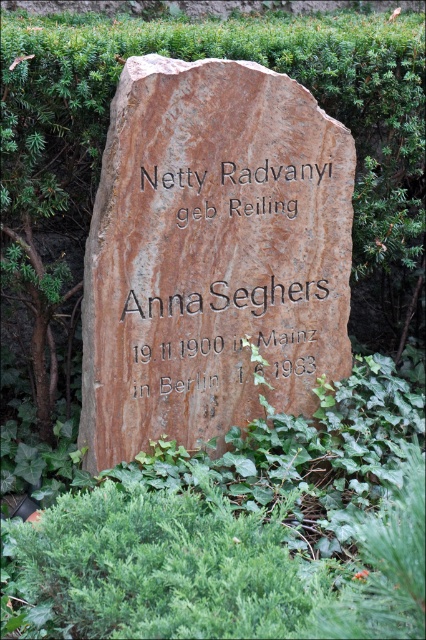
Based on the photo, who is more distant from viewer, (210, 152) or (221, 342)?

The point (221, 342) is behind.

Who is higher up, brown stone boulder at center or matte stone inscription at center?

brown stone boulder at center

Does point (273, 132) come behind point (164, 300)?

Yes, it is.

The width and height of the screenshot is (426, 640). I want to click on brown stone boulder at center, so click(212, 253).